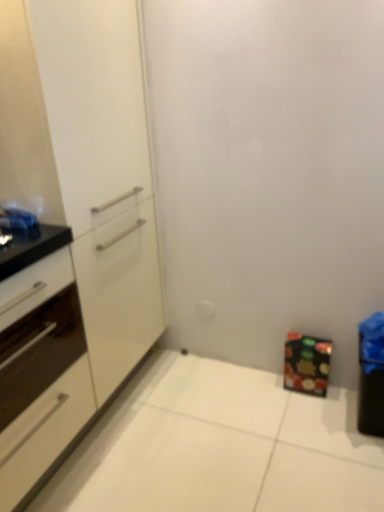
Find the location of a particular element. white glossy cabinet at left, marked as the 1th cabinetry in a left-to-right arrangement is located at coordinates (39, 358).

This screenshot has width=384, height=512. What are the coordinates of `matte black cabinet at lower right, the first cabinetry viewed from the right` in the screenshot? It's located at (306, 364).

Considering the positions of point (309, 373) and point (144, 304), is point (309, 373) closer or farther from the camera than point (144, 304)?

Point (309, 373) is closer to the camera than point (144, 304).

Is matte black cabinet at lower right, which appears as the 3th cabinetry when viewed from the left, wider than white glossy cabinet at left, the second cabinetry positioned from the right?

Yes, matte black cabinet at lower right, which appears as the 3th cabinetry when viewed from the left, is wider than white glossy cabinet at left, the second cabinetry positioned from the right.

Is matte black cabinet at lower right, the first cabinetry viewed from the right, not inside white glossy cabinet at left, the second cabinetry positioned from the right?

Yes.

Is matte black cabinet at lower right, which appears as the 3th cabinetry when viewed from the left, bigger or smaller than white glossy cabinet at left, marked as the 2th cabinetry in a left-to-right arrangement?

In the image, matte black cabinet at lower right, which appears as the 3th cabinetry when viewed from the left, appears to be smaller than white glossy cabinet at left, marked as the 2th cabinetry in a left-to-right arrangement.

Does white glossy cabinet at left, which is counted as the 3th cabinetry, starting from the right, have a lesser width compared to white glossy cabinet at left, marked as the 2th cabinetry in a left-to-right arrangement?

Incorrect, the width of white glossy cabinet at left, which is counted as the 3th cabinetry, starting from the right, is not less than that of white glossy cabinet at left, marked as the 2th cabinetry in a left-to-right arrangement.

Considering the positions of points (2, 465) and (51, 205), is point (2, 465) farther from camera compared to point (51, 205)?

No, (2, 465) is closer to viewer.

Could you tell me if white glossy cabinet at left, which is counted as the 3th cabinetry, starting from the right, is turned towards white glossy cabinet at left, the second cabinetry positioned from the right?

Yes, white glossy cabinet at left, which is counted as the 3th cabinetry, starting from the right, is oriented towards white glossy cabinet at left, the second cabinetry positioned from the right.

Is white glossy cabinet at left, marked as the 2th cabinetry in a left-to-right arrangement, at the left side of white glossy cabinet at left, which is counted as the 3th cabinetry, starting from the right?

No, white glossy cabinet at left, marked as the 2th cabinetry in a left-to-right arrangement, is not to the left of white glossy cabinet at left, which is counted as the 3th cabinetry, starting from the right.

Which is correct: white glossy cabinet at left, marked as the 2th cabinetry in a left-to-right arrangement, is inside white glossy cabinet at left, marked as the 1th cabinetry in a left-to-right arrangement, or outside of it?

white glossy cabinet at left, marked as the 2th cabinetry in a left-to-right arrangement, exists outside the volume of white glossy cabinet at left, marked as the 1th cabinetry in a left-to-right arrangement.

Is white glossy cabinet at left, the second cabinetry positioned from the right, placed right next to white glossy cabinet at left, marked as the 1th cabinetry in a left-to-right arrangement?

No, white glossy cabinet at left, the second cabinetry positioned from the right, is not next to white glossy cabinet at left, marked as the 1th cabinetry in a left-to-right arrangement.

From a real-world perspective, is white glossy cabinet at left, which is counted as the 3th cabinetry, starting from the right, over matte black cabinet at lower right, which appears as the 3th cabinetry when viewed from the left?

Yes, from a real-world perspective, white glossy cabinet at left, which is counted as the 3th cabinetry, starting from the right, is over matte black cabinet at lower right, which appears as the 3th cabinetry when viewed from the left

Looking at this image, does white glossy cabinet at left, marked as the 1th cabinetry in a left-to-right arrangement, have a smaller size compared to matte black cabinet at lower right, the first cabinetry viewed from the right?

Actually, white glossy cabinet at left, marked as the 1th cabinetry in a left-to-right arrangement, might be larger than matte black cabinet at lower right, the first cabinetry viewed from the right.

Is white glossy cabinet at left, which is counted as the 3th cabinetry, starting from the right, positioned before matte black cabinet at lower right, which appears as the 3th cabinetry when viewed from the left?

Yes, white glossy cabinet at left, which is counted as the 3th cabinetry, starting from the right, is closer to the viewer.

How different are the orientations of white glossy cabinet at left, marked as the 1th cabinetry in a left-to-right arrangement, and matte black cabinet at lower right, which appears as the 3th cabinetry when viewed from the left, in degrees?

The angle between the facing direction of white glossy cabinet at left, marked as the 1th cabinetry in a left-to-right arrangement, and the facing direction of matte black cabinet at lower right, which appears as the 3th cabinetry when viewed from the left, is 90 degrees.

Is point (292, 382) closer to viewer compared to point (41, 417)?

No.

Is matte black cabinet at lower right, which appears as the 3th cabinetry when viewed from the left, turned away from white glossy cabinet at left, which is counted as the 3th cabinetry, starting from the right?

No, matte black cabinet at lower right, which appears as the 3th cabinetry when viewed from the left,'s orientation is not away from white glossy cabinet at left, which is counted as the 3th cabinetry, starting from the right.

Relative to white glossy cabinet at left, marked as the 1th cabinetry in a left-to-right arrangement, is matte black cabinet at lower right, the first cabinetry viewed from the right, in front or behind?

Clearly, matte black cabinet at lower right, the first cabinetry viewed from the right, is behind white glossy cabinet at left, marked as the 1th cabinetry in a left-to-right arrangement.

Does matte black cabinet at lower right, the first cabinetry viewed from the right, have a smaller size compared to white glossy cabinet at left, which is counted as the 3th cabinetry, starting from the right?

Yes, matte black cabinet at lower right, the first cabinetry viewed from the right, is smaller than white glossy cabinet at left, which is counted as the 3th cabinetry, starting from the right.

From the image's perspective, between white glossy cabinet at left, marked as the 2th cabinetry in a left-to-right arrangement, and matte black cabinet at lower right, the first cabinetry viewed from the right, which one is located above?

white glossy cabinet at left, marked as the 2th cabinetry in a left-to-right arrangement, from the image's perspective.

Is white glossy cabinet at left, marked as the 2th cabinetry in a left-to-right arrangement, at the left side of matte black cabinet at lower right, the first cabinetry viewed from the right?

Yes.

Considering the positions of point (25, 25) and point (328, 368), is point (25, 25) closer or farther from the camera than point (328, 368)?

Point (25, 25) is positioned closer to the camera compared to point (328, 368).

Does white glossy cabinet at left, the second cabinetry positioned from the right, turn towards matte black cabinet at lower right, which appears as the 3th cabinetry when viewed from the left?

No.

You are a GUI agent. You are given a task and a screenshot of the screen. Output one action in this format:
    pyautogui.click(x=<x>, y=<y>)
    Task: Click on the 2nd cabinetry directly above the matte black cabinet at lower right, which appears as the 3th cabinetry when viewed from the left (from a real-world perspective)
    The width and height of the screenshot is (384, 512).
    Given the screenshot: What is the action you would take?
    pyautogui.click(x=71, y=225)

Identify the location of the 1st cabinetry below when counting from the white glossy cabinet at left, the second cabinetry positioned from the right (from the image's perspective). (39, 358).

Based on their spatial positions, is matte black cabinet at lower right, which appears as the 3th cabinetry when viewed from the left, or white glossy cabinet at left, which is counted as the 3th cabinetry, starting from the right, further from white glossy cabinet at left, the second cabinetry positioned from the right?

matte black cabinet at lower right, which appears as the 3th cabinetry when viewed from the left, is further to white glossy cabinet at left, the second cabinetry positioned from the right.

Looking at the image, which one is located closer to white glossy cabinet at left, the second cabinetry positioned from the right, white glossy cabinet at left, marked as the 1th cabinetry in a left-to-right arrangement, or matte black cabinet at lower right, the first cabinetry viewed from the right?

white glossy cabinet at left, marked as the 1th cabinetry in a left-to-right arrangement, is closer to white glossy cabinet at left, the second cabinetry positioned from the right.

Which object lies further to the anchor point matte black cabinet at lower right, which appears as the 3th cabinetry when viewed from the left, white glossy cabinet at left, marked as the 1th cabinetry in a left-to-right arrangement, or white glossy cabinet at left, the second cabinetry positioned from the right?

Based on the image, white glossy cabinet at left, marked as the 1th cabinetry in a left-to-right arrangement, appears to be further to matte black cabinet at lower right, which appears as the 3th cabinetry when viewed from the left.

From the image, which object appears to be nearer to white glossy cabinet at left, marked as the 1th cabinetry in a left-to-right arrangement, white glossy cabinet at left, marked as the 2th cabinetry in a left-to-right arrangement, or matte black cabinet at lower right, the first cabinetry viewed from the right?

white glossy cabinet at left, marked as the 2th cabinetry in a left-to-right arrangement, is closer to white glossy cabinet at left, marked as the 1th cabinetry in a left-to-right arrangement.

Considering their positions, is white glossy cabinet at left, the second cabinetry positioned from the right, positioned closer to matte black cabinet at lower right, the first cabinetry viewed from the right, than white glossy cabinet at left, marked as the 1th cabinetry in a left-to-right arrangement?

white glossy cabinet at left, the second cabinetry positioned from the right, is closer to matte black cabinet at lower right, the first cabinetry viewed from the right.

Based on the photo, estimate the real-world distances between objects in this image. Which object is closer to white glossy cabinet at left, marked as the 1th cabinetry in a left-to-right arrangement, matte black cabinet at lower right, the first cabinetry viewed from the right, or white glossy cabinet at left, marked as the 2th cabinetry in a left-to-right arrangement?

Among the two, white glossy cabinet at left, marked as the 2th cabinetry in a left-to-right arrangement, is located nearer to white glossy cabinet at left, marked as the 1th cabinetry in a left-to-right arrangement.

I want to click on cabinetry located between white glossy cabinet at left, marked as the 1th cabinetry in a left-to-right arrangement, and matte black cabinet at lower right, the first cabinetry viewed from the right, in the left-right direction, so click(x=71, y=225).